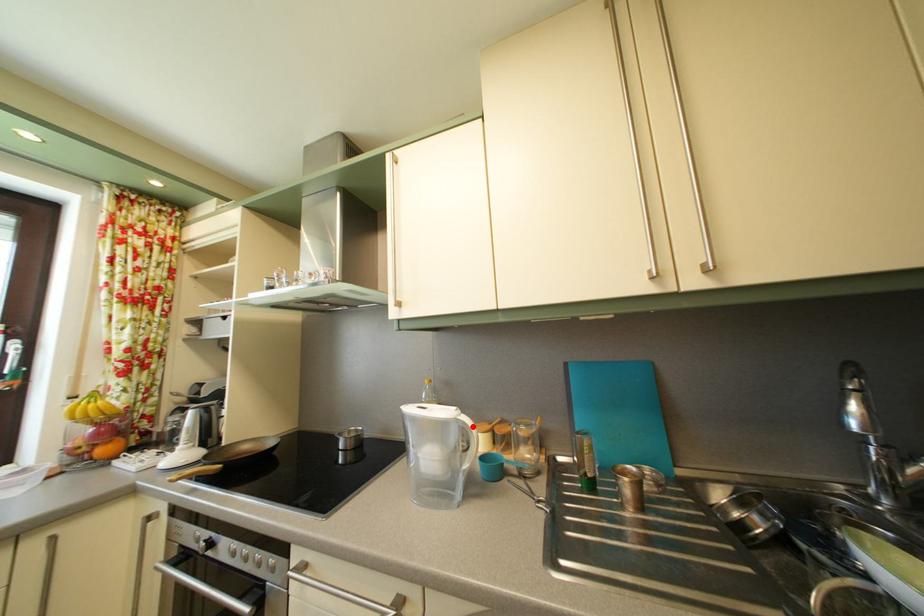
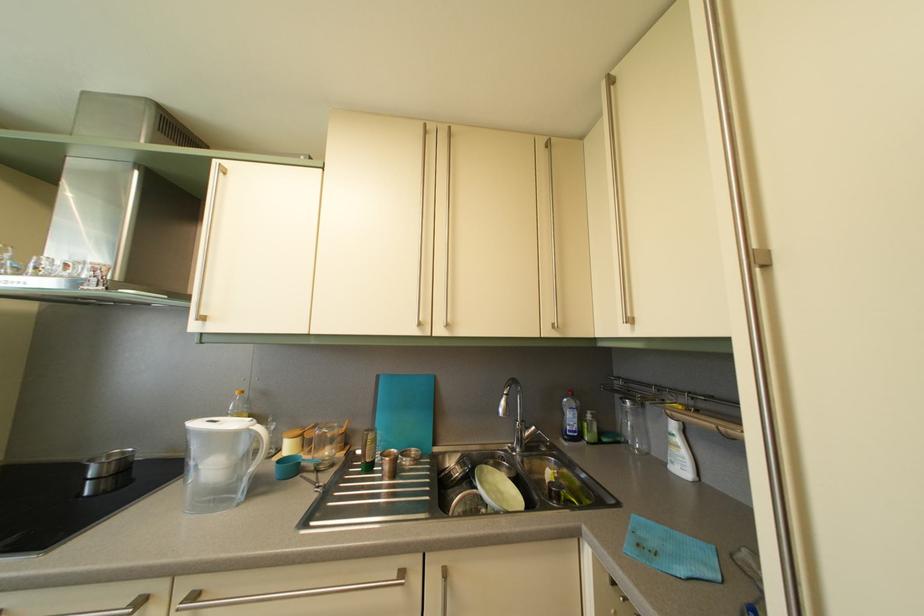
Where in the second image is the point corresponding to the highlighted location from the first image?

(266, 436)